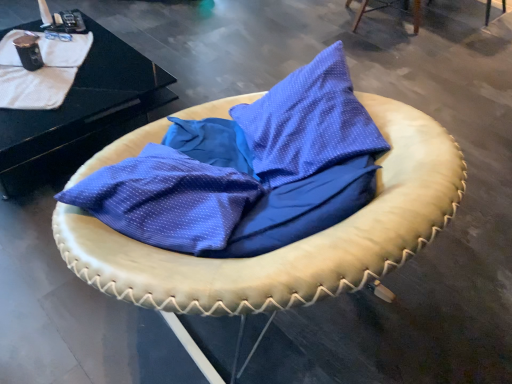
Find the location of `vacant area that is situated to the right of white textured blanket at upper left`. vacant area that is situated to the right of white textured blanket at upper left is located at coordinates [x=92, y=81].